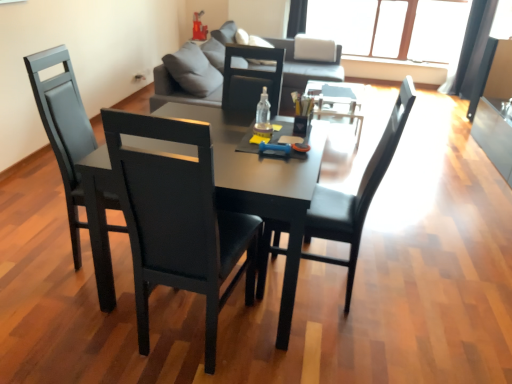
Question: In the image, is matte black table at center positioned in front of or behind black leather chair at center, the 1th chair from the right?

Choices:
 (A) behind
 (B) front

Answer: (A)

Question: Considering the positions of matte black table at center and black leather chair at center, the 1th chair from the right, in the image, is matte black table at center taller or shorter than black leather chair at center, the 1th chair from the right,?

Choices:
 (A) short
 (B) tall

Answer: (A)

Question: Based on their relative distances, which object is farther from the transparent plastic bottle at center?

Choices:
 (A) black leather chair at left, which is the 2th chair from left to right
 (B) black leather chair at center, the third chair from the left
 (C) matte black chair at left, the third chair viewed from the right
 (D) transparent plastic organizer at center
 (E) transparent glass window at upper center

Answer: (E)

Question: Which object is the farthest from the matte black chair at left, placed as the 1th chair when sorted from left to right?

Choices:
 (A) dark gray leather couch at upper center
 (B) transparent plastic organizer at center
 (C) matte black table at center
 (D) transparent plastic bottle at center
 (E) black leather chair at left, which is the 2th chair from left to right

Answer: (A)